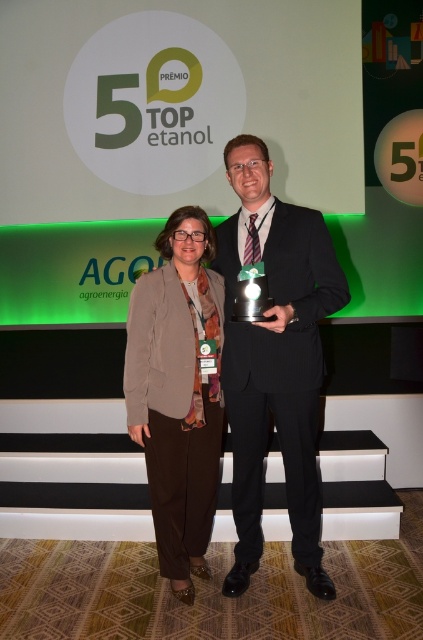
Question: Is black pinstripe suit at center thinner than brown fabric jacket at center?

Choices:
 (A) no
 (B) yes

Answer: (A)

Question: Which point appears closest to the camera in this image?

Choices:
 (A) click(288, 388)
 (B) click(216, 468)

Answer: (A)

Question: Where is black pinstripe suit at center located in relation to brown fabric jacket at center in the image?

Choices:
 (A) above
 (B) below

Answer: (A)

Question: Is black pinstripe suit at center closer to camera compared to brown fabric jacket at center?

Choices:
 (A) yes
 (B) no

Answer: (A)

Question: Which of the following is the farthest from the observer?

Choices:
 (A) (257, 230)
 (B) (184, 288)

Answer: (B)